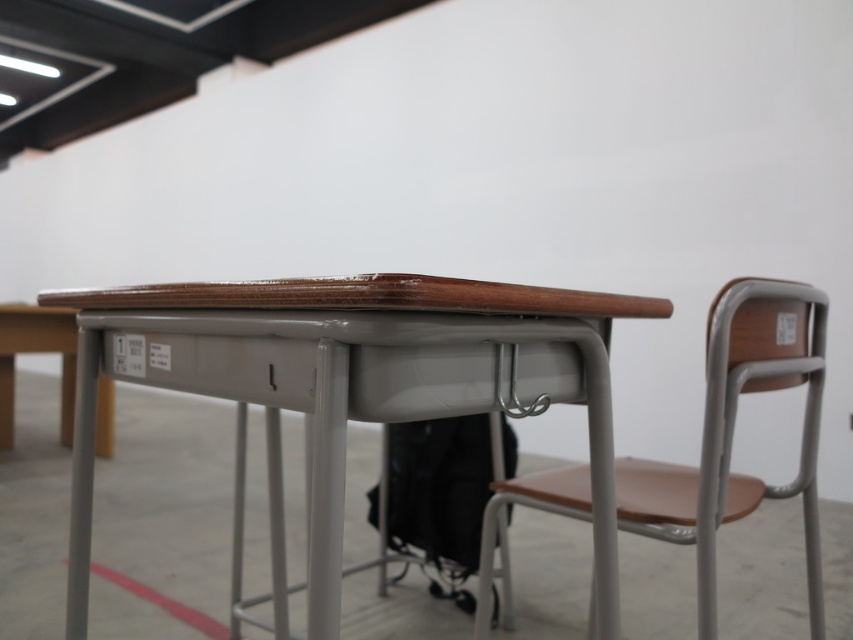
Does wooden/matte table at center appear on the right side of brown wood chair at center?

Incorrect, wooden/matte table at center is not on the right side of brown wood chair at center.

Who is more forward, (343, 458) or (798, 296)?

Point (343, 458) is more forward.

The image size is (853, 640). Find the location of `wooden/matte table at center`. wooden/matte table at center is located at coordinates (347, 387).